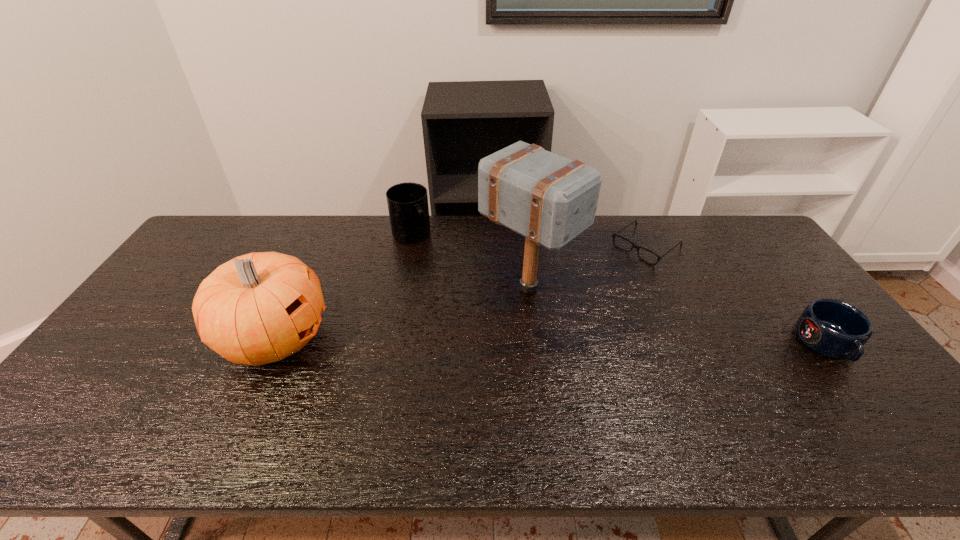
Identify the location of vacant area located on the front-facing side of the fourth object from left to right. (608, 276).

At what (x,y) coordinates should I click in order to perform the action: click on mug that is positioned at the far edge. Please return your answer as a coordinate pair (x, y). Image resolution: width=960 pixels, height=540 pixels. Looking at the image, I should click on (407, 202).

This screenshot has height=540, width=960. Identify the location of spectacles at the far edge. (614, 235).

Locate an element on the screen. Image resolution: width=960 pixels, height=540 pixels. object that is at the near edge is located at coordinates (258, 308).

The width and height of the screenshot is (960, 540). I want to click on object that is at the right edge, so click(832, 328).

Locate an element on the screen. vacant area at the far edge of the desktop is located at coordinates (270, 244).

The image size is (960, 540). I want to click on vacant region at the near edge, so click(480, 383).

This screenshot has height=540, width=960. Find the location of `vacant space at the left edge`. vacant space at the left edge is located at coordinates (179, 303).

At what (x,y) coordinates should I click in order to perform the action: click on vacant space in between the right mug and the third object from right to left. Please return your answer as a coordinate pair (x, y). Looking at the image, I should click on (678, 316).

Where is `free space between the third object from right to left and the shortest object`? This screenshot has width=960, height=540. free space between the third object from right to left and the shortest object is located at coordinates (587, 267).